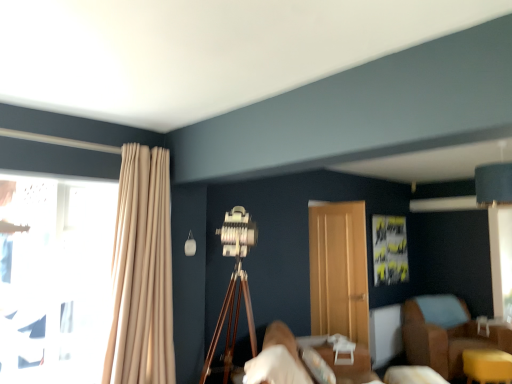
Question: Can you confirm if brown leather armchair at lower right is smaller than wooden door at center?

Choices:
 (A) yes
 (B) no

Answer: (B)

Question: Is brown leather armchair at lower right taller than wooden door at center?

Choices:
 (A) no
 (B) yes

Answer: (A)

Question: From a real-world perspective, does brown leather armchair at lower right stand above wooden door at center?

Choices:
 (A) no
 (B) yes

Answer: (A)

Question: Is brown leather armchair at lower right not close to wooden door at center?

Choices:
 (A) yes
 (B) no

Answer: (A)

Question: Is brown leather armchair at lower right at the right side of wooden door at center?

Choices:
 (A) yes
 (B) no

Answer: (A)

Question: Is brown leather armchair at lower right oriented towards wooden door at center?

Choices:
 (A) yes
 (B) no

Answer: (B)

Question: Can you confirm if brown leather armchair at lower right is taller than beige fabric curtain at left?

Choices:
 (A) yes
 (B) no

Answer: (B)

Question: Can we say brown leather armchair at lower right lies outside beige fabric curtain at left?

Choices:
 (A) yes
 (B) no

Answer: (A)

Question: Does brown leather armchair at lower right appear on the left side of beige fabric curtain at left?

Choices:
 (A) yes
 (B) no

Answer: (B)

Question: Is brown leather armchair at lower right positioned far away from beige fabric curtain at left?

Choices:
 (A) no
 (B) yes

Answer: (B)

Question: Are brown leather armchair at lower right and beige fabric curtain at left making contact?

Choices:
 (A) yes
 (B) no

Answer: (B)

Question: Is brown leather armchair at lower right further to camera compared to beige fabric curtain at left?

Choices:
 (A) no
 (B) yes

Answer: (B)

Question: Does wooden door at center turn towards white fabric bed at lower center?

Choices:
 (A) yes
 (B) no

Answer: (B)